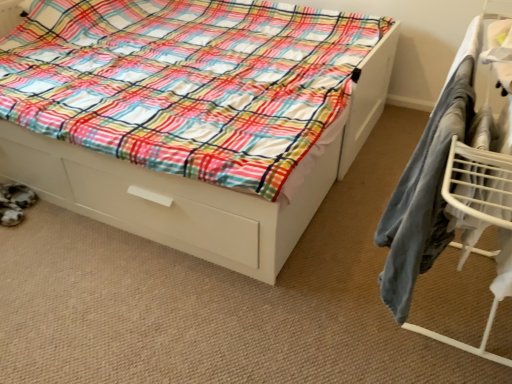
Question: Is metal drying rack at right closer to the viewer compared to white glossy bed at center?

Choices:
 (A) yes
 (B) no

Answer: (A)

Question: Is metal drying rack at right behind white glossy bed at center?

Choices:
 (A) yes
 (B) no

Answer: (B)

Question: From a real-world perspective, is metal drying rack at right physically above white glossy bed at center?

Choices:
 (A) no
 (B) yes

Answer: (B)

Question: Is metal drying rack at right wider than white glossy bed at center?

Choices:
 (A) no
 (B) yes

Answer: (A)

Question: Considering the relative positions of metal drying rack at right and white glossy bed at center in the image provided, is metal drying rack at right to the left of white glossy bed at center from the viewer's perspective?

Choices:
 (A) no
 (B) yes

Answer: (A)

Question: Would you consider metal drying rack at right to be distant from white glossy bed at center?

Choices:
 (A) yes
 (B) no

Answer: (B)

Question: Is white glossy bed at center not close to metal drying rack at right?

Choices:
 (A) yes
 (B) no

Answer: (B)

Question: Can you confirm if white glossy bed at center is shorter than metal drying rack at right?

Choices:
 (A) yes
 (B) no

Answer: (A)

Question: Considering the relative sizes of white glossy bed at center and metal drying rack at right in the image provided, is white glossy bed at center bigger than metal drying rack at right?

Choices:
 (A) yes
 (B) no

Answer: (A)

Question: From a real-world perspective, does white glossy bed at center sit lower than metal drying rack at right?

Choices:
 (A) no
 (B) yes

Answer: (B)

Question: From the image's perspective, is white glossy bed at center under metal drying rack at right?

Choices:
 (A) no
 (B) yes

Answer: (A)

Question: Does white glossy bed at center appear on the left side of metal drying rack at right?

Choices:
 (A) yes
 (B) no

Answer: (A)

Question: In terms of height, does metal drying rack at right look taller or shorter compared to white glossy bed at center?

Choices:
 (A) tall
 (B) short

Answer: (A)